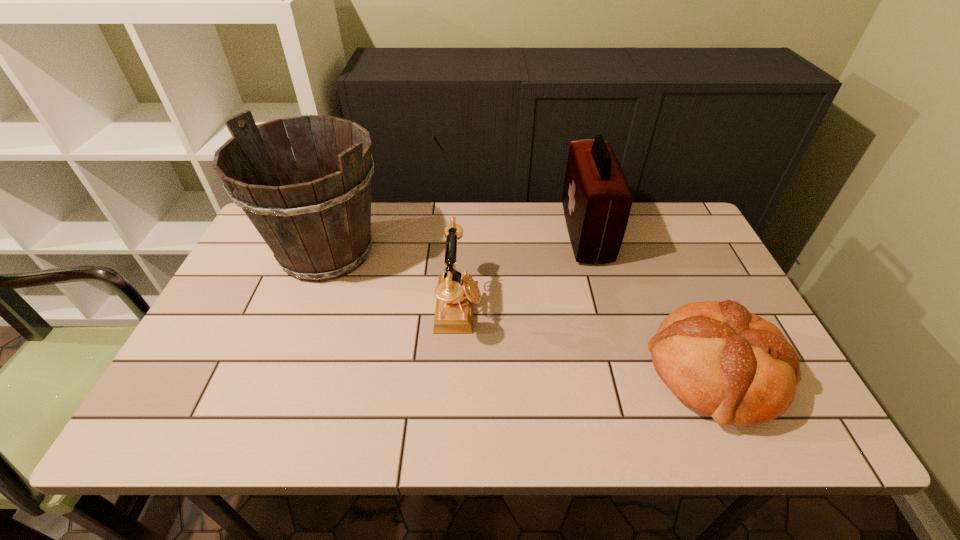
The height and width of the screenshot is (540, 960). In order to click on vacant space located on the dial of the telephone in this screenshot , I will do `click(629, 308)`.

The width and height of the screenshot is (960, 540). Identify the location of vacant point located 0.260m on the left of the shortest object. (533, 373).

Locate an element on the screen. The height and width of the screenshot is (540, 960). bucket that is positioned at the far edge is located at coordinates (316, 220).

This screenshot has height=540, width=960. I want to click on the first aid kit that is at the far edge, so click(x=597, y=200).

What are the coordinates of `object present at the near edge` in the screenshot? It's located at (724, 362).

Find the location of a particular element. Image resolution: width=960 pixels, height=540 pixels. object positioned at the left edge is located at coordinates coord(316,220).

You are a GUI agent. You are given a task and a screenshot of the screen. Output one action in this format:
    pyautogui.click(x=<x>, y=<y>)
    Task: Click on the object present at the right edge
    This screenshot has width=960, height=540.
    Given the screenshot: What is the action you would take?
    pyautogui.click(x=724, y=362)

The image size is (960, 540). I want to click on object located in the far left corner section of the desktop, so click(316, 220).

Where is `object present at the near right corner`? This screenshot has height=540, width=960. object present at the near right corner is located at coordinates (724, 362).

Image resolution: width=960 pixels, height=540 pixels. I want to click on vacant area at the far edge of the desktop, so click(413, 246).